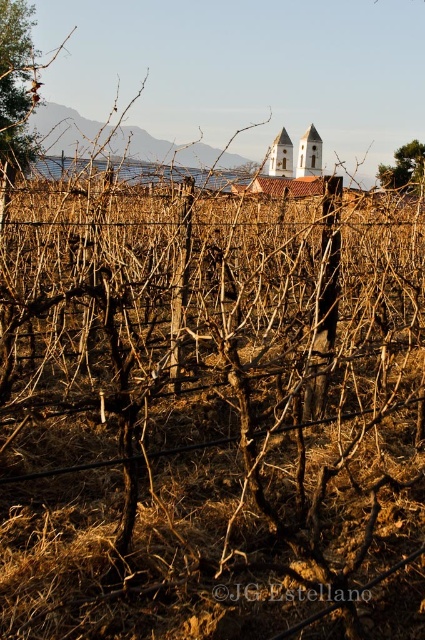
You are a gardener planning to install a new trellis system in the vineyard. You have a limited amount of wire mesh material. Given the wire mesh at center and the white stucco chapel at center, which object would require more material to replicate its size?

The white stucco chapel at center requires more material to replicate its size because it is larger than the wire mesh at center.

You are standing in the vineyard looking towards the building with the reddish brown tiled roof. There are two points marked in the scene, point 1 at coordinates point (5, 26) and point 2 at coordinates point (252, 182). Which point is closer to you?

Point (5, 26) is closer to the camera than point (252, 182).

You are an architect designing a new garden layout. You have a limited space and need to decide between placing the brown wood tree at upper left or the white stucco church at center. Based on their sizes, which one would require less area?

The brown wood tree at upper left occupies less space than the white stucco church at center, so it would require less area.